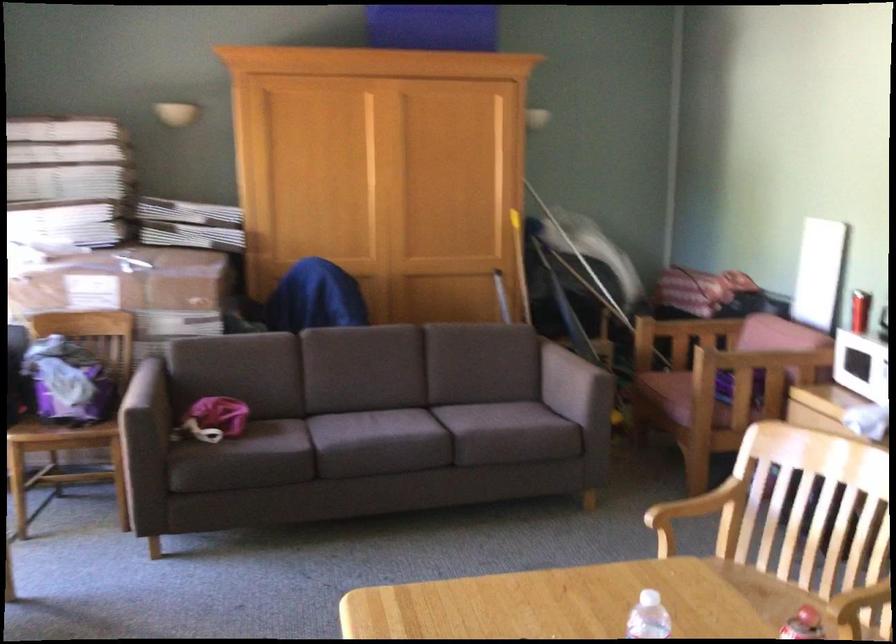
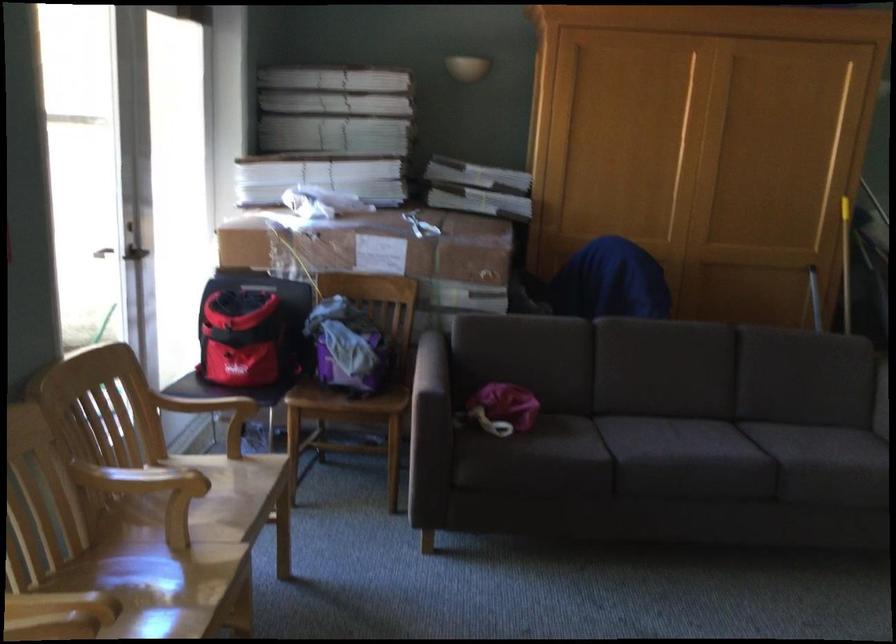
Find the pixel in the second image that matches the point at 403,421 in the first image.

(724, 439)